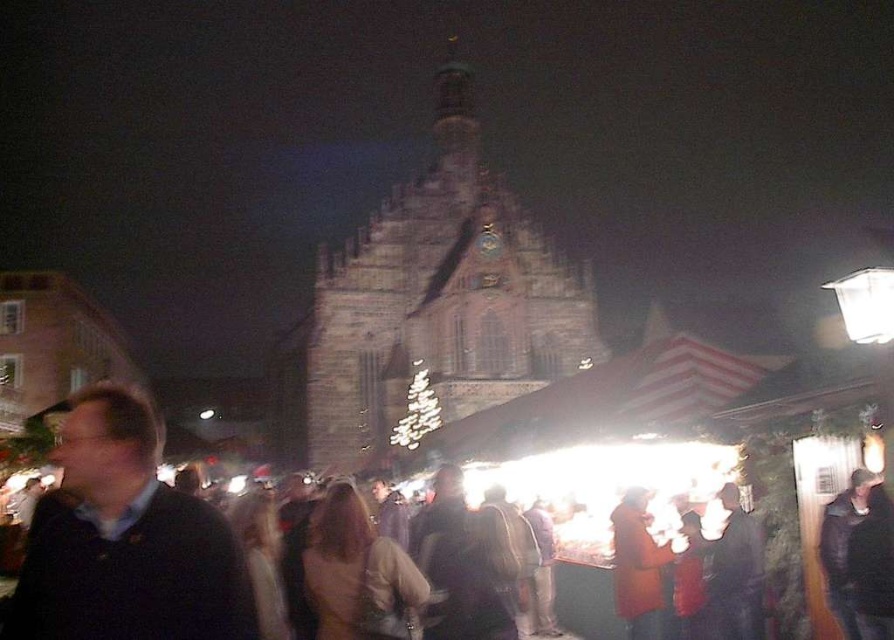
From the picture: You are standing at the Christmas market and want to know how far the point at coordinates point (541, 308) is from you. Can you determine the distance?

The distance of point (541, 308) from viewer is 127.93 meters.

You are standing in the middle of the Christmas market and want to take a photo of the dark stone church at center. However, there is a person wearing a dark brown leather jacket at lower right blocking your view. Can you move to the left or right to get a clear shot of the church without the jacket in the frame?

The dark stone church at center is further to the viewer than the dark brown leather jacket at lower right, so moving to the left or right might allow you to position yourself so that the jacket is no longer blocking the view of the church.

You are standing at the camera position and want to take a photo of the dark stone church at center. The camera has a maximum focus range of 100 meters. Will the church be in focus?

The dark stone church at center is 105.24 meters away from camera, which exceeds the camera maximum focus range of 100 meters. Therefore, the church will not be in focus.